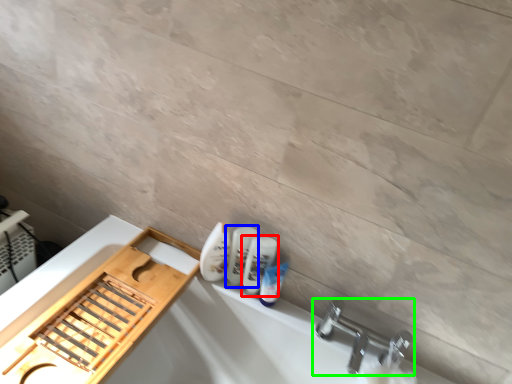
Question: Considering the real-world distances, which object is farthest from mouthwash (highlighted by a red box)? mouthwash (highlighted by a blue box) or tap (highlighted by a green box)?

Choices:
 (A) mouthwash
 (B) tap

Answer: (B)